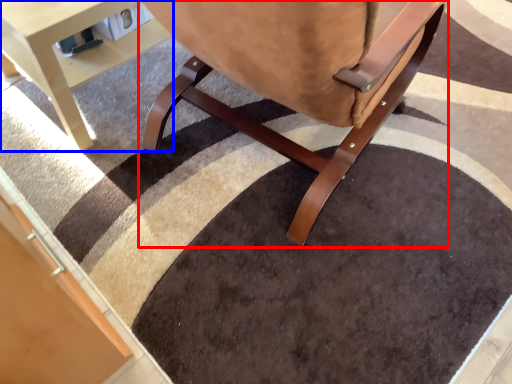
Question: Which point is closer to the camera, chair (highlighted by a red box) or table (highlighted by a blue box)?

Choices:
 (A) chair
 (B) table

Answer: (A)